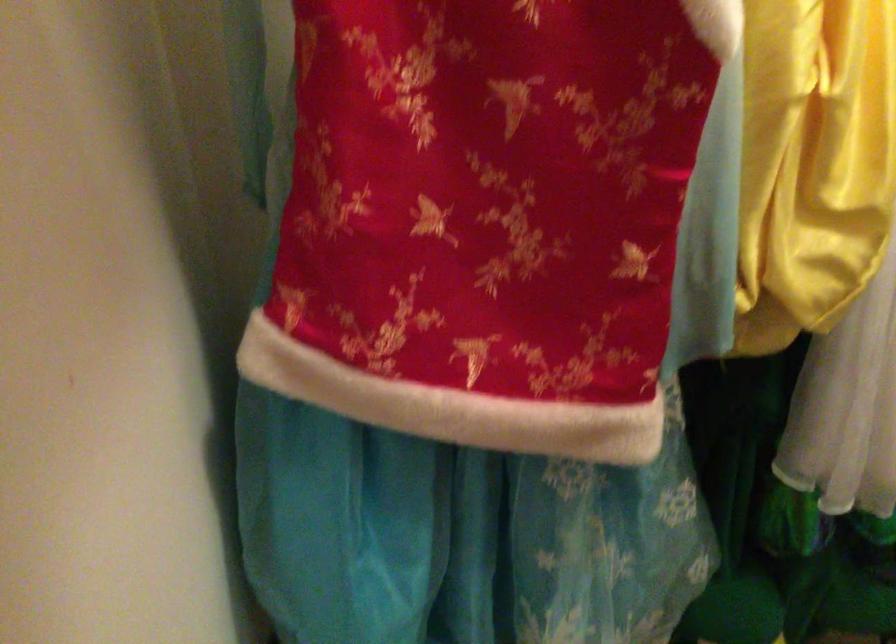
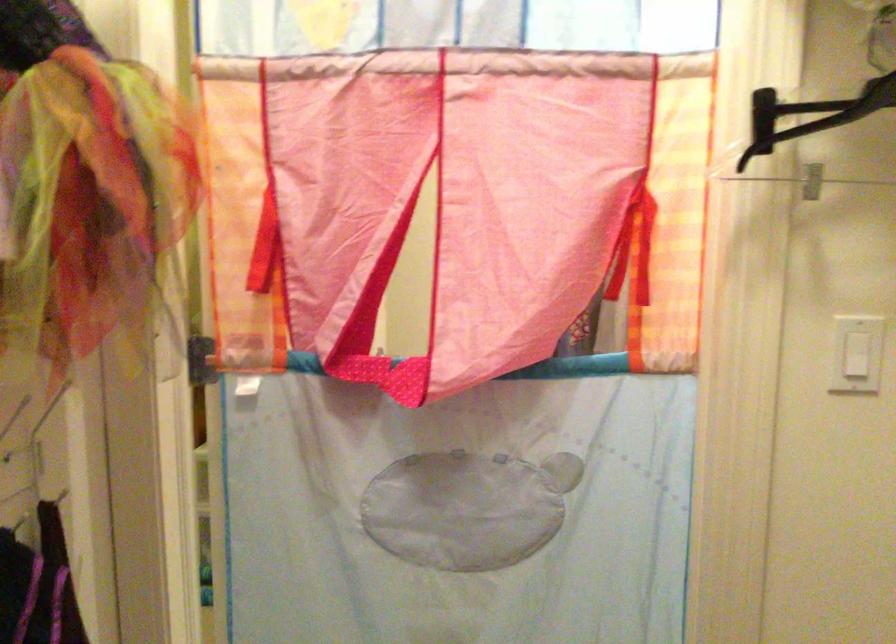
Question: The camera is either moving clockwise (left) or counter-clockwise (right) around the object. The first image is from the beginning of the video and the second image is from the end. Is the camera moving left or right when shooting the video?

Choices:
 (A) Left
 (B) Right

Answer: (A)